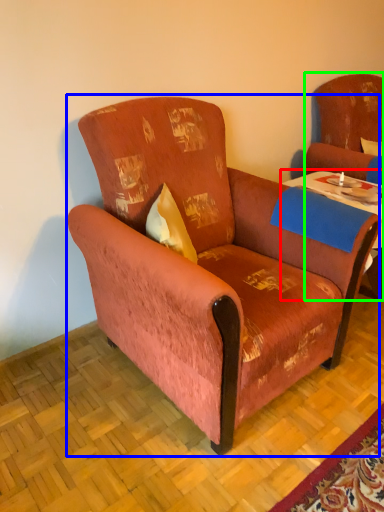
Question: Which object is the closest to the table (highlighted by a red box)? Choose among these: chair (highlighted by a blue box) or swivel chair (highlighted by a green box).

Choices:
 (A) chair
 (B) swivel chair

Answer: (B)